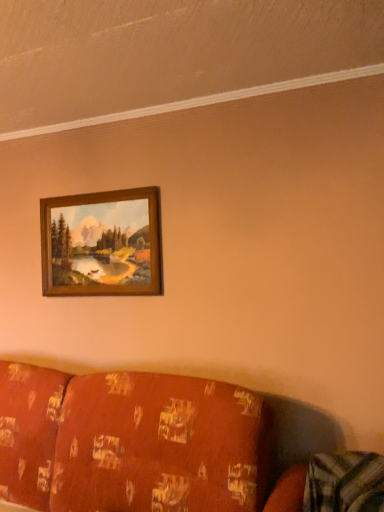
This screenshot has width=384, height=512. Identify the location of wooden frame at upper center. (102, 244).

This screenshot has height=512, width=384. What do you see at coordinates (102, 244) in the screenshot?
I see `wooden frame at upper center` at bounding box center [102, 244].

Looking at this image, measure the distance between point (127, 257) and camera.

Point (127, 257) is 8.18 feet away from camera.

Locate an element on the screen. patterned fabric couch at lower left is located at coordinates (130, 442).

The width and height of the screenshot is (384, 512). What do you see at coordinates (130, 442) in the screenshot?
I see `patterned fabric couch at lower left` at bounding box center [130, 442].

In order to face patterned fabric couch at lower left, should I rotate leftwards or rightwards?

To face it directly, rotate left by 16.506 degrees.

What are the coordinates of `wooden frame at upper center` in the screenshot? It's located at (102, 244).

Consider the image. In the image, is wooden frame at upper center on the left side or the right side of patterned fabric couch at lower left?

Clearly, wooden frame at upper center is on the left of patterned fabric couch at lower left in the image.

Is wooden frame at upper center in front of patterned fabric couch at lower left?

No, it is behind patterned fabric couch at lower left.

Which is in front, point (157, 243) or point (232, 406)?

Positioned in front is point (232, 406).

From the image's perspective, is wooden frame at upper center below patterned fabric couch at lower left?

No, from the image's perspective, wooden frame at upper center is not beneath patterned fabric couch at lower left.

From a real-world perspective, is wooden frame at upper center beneath patterned fabric couch at lower left?

Actually, wooden frame at upper center is physically above patterned fabric couch at lower left in the real world.

Can you confirm if wooden frame at upper center is thinner than patterned fabric couch at lower left?

Indeed, wooden frame at upper center has a lesser width compared to patterned fabric couch at lower left.

Considering the relative sizes of wooden frame at upper center and patterned fabric couch at lower left in the image provided, is wooden frame at upper center shorter than patterned fabric couch at lower left?

Yes.

Considering the sizes of objects wooden frame at upper center and patterned fabric couch at lower left in the image provided, who is smaller, wooden frame at upper center or patterned fabric couch at lower left?

wooden frame at upper center is smaller.

Is wooden frame at upper center outside of patterned fabric couch at lower left?

Yes, wooden frame at upper center is outside of patterned fabric couch at lower left.

Is wooden frame at upper center not close to patterned fabric couch at lower left?

wooden frame at upper center is near patterned fabric couch at lower left, not far away.

Is wooden frame at upper center oriented towards patterned fabric couch at lower left?

No, wooden frame at upper center is not aimed at patterned fabric couch at lower left.

What's the angular difference between wooden frame at upper center and patterned fabric couch at lower left's facing directions?

0.0034 degrees separate the facing orientations of wooden frame at upper center and patterned fabric couch at lower left.

This screenshot has height=512, width=384. I want to click on studio couch below the wooden frame at upper center (from the image's perspective), so click(x=130, y=442).

Between patterned fabric couch at lower left and wooden frame at upper center, which one appears on the left side from the viewer's perspective?

wooden frame at upper center is more to the left.

Is patterned fabric couch at lower left in front of or behind wooden frame at upper center in the image?

In the image, patterned fabric couch at lower left appears in front of wooden frame at upper center.

Is point (89, 378) farther from camera compared to point (69, 251)?

No, (89, 378) is in front of (69, 251).

From the image's perspective, who appears lower, patterned fabric couch at lower left or wooden frame at upper center?

From the image's view, patterned fabric couch at lower left is below.

From a real-world perspective, who is located lower, patterned fabric couch at lower left or wooden frame at upper center?

patterned fabric couch at lower left.

Considering the sizes of objects patterned fabric couch at lower left and wooden frame at upper center in the image provided, who is thinner, patterned fabric couch at lower left or wooden frame at upper center?

wooden frame at upper center.

Who is shorter, patterned fabric couch at lower left or wooden frame at upper center?

wooden frame at upper center.

Is patterned fabric couch at lower left bigger than wooden frame at upper center?

Yes, patterned fabric couch at lower left is bigger than wooden frame at upper center.

Is patterned fabric couch at lower left outside of wooden frame at upper center?

Yes, patterned fabric couch at lower left is not within wooden frame at upper center.

Is patterned fabric couch at lower left next to wooden frame at upper center and touching it?

No, patterned fabric couch at lower left is not in contact with wooden frame at upper center.

Is patterned fabric couch at lower left oriented towards wooden frame at upper center?

No, patterned fabric couch at lower left is not oriented towards wooden frame at upper center.

From the picture: What's the angular difference between patterned fabric couch at lower left and wooden frame at upper center's facing directions?

The angle between the facing direction of patterned fabric couch at lower left and the facing direction of wooden frame at upper center is 0.0034 degrees.

At what (x,y) coordinates should I click in order to perform the action: click on studio couch to the right of wooden frame at upper center. Please return your answer as a coordinate pair (x, y). Looking at the image, I should click on (130, 442).

You are a GUI agent. You are given a task and a screenshot of the screen. Output one action in this format:
    pyautogui.click(x=<x>, y=<y>)
    Task: Click on the picture frame that appears above the patterned fabric couch at lower left (from the image's perspective)
    The height and width of the screenshot is (512, 384).
    Given the screenshot: What is the action you would take?
    pyautogui.click(x=102, y=244)

Locate an element on the screen. Image resolution: width=384 pixels, height=512 pixels. picture frame that is on the left side of patterned fabric couch at lower left is located at coordinates (102, 244).